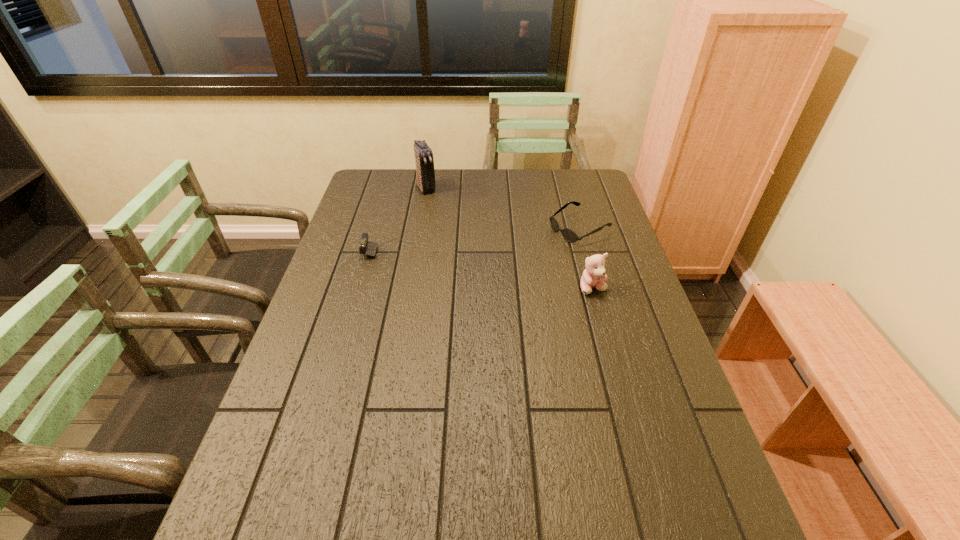
This screenshot has width=960, height=540. Find the location of `webcam`. webcam is located at coordinates (369, 248).

You are a GUI agent. You are given a task and a screenshot of the screen. Output one action in this format:
    pyautogui.click(x=<x>, y=<y>)
    Task: Click on the second tallest object
    
    Given the screenshot: What is the action you would take?
    pyautogui.click(x=594, y=275)

I want to click on the nearest object, so pos(594,275).

Where is `the tallest object`? This screenshot has width=960, height=540. the tallest object is located at coordinates (425, 172).

Image resolution: width=960 pixels, height=540 pixels. I want to click on clutch bag, so click(x=425, y=172).

What are the coordinates of `sunglasses` in the screenshot? It's located at (569, 235).

You are a GUI agent. You are given a task and a screenshot of the screen. Output one action in this format:
    pyautogui.click(x=<x>, y=<y>)
    Task: Click on the free region located at the face of the teddy bear
    The image size is (960, 540).
    Given the screenshot: What is the action you would take?
    pyautogui.click(x=628, y=416)

Identify the location of vacant space located with the zip open on the tallest object. Image resolution: width=960 pixels, height=540 pixels. (437, 206).

This screenshot has height=540, width=960. I want to click on free spot located with the zip open on the tallest object, so click(x=440, y=211).

In order to click on vacant space located with the zip open on the tallest object in this screenshot , I will do `click(452, 231)`.